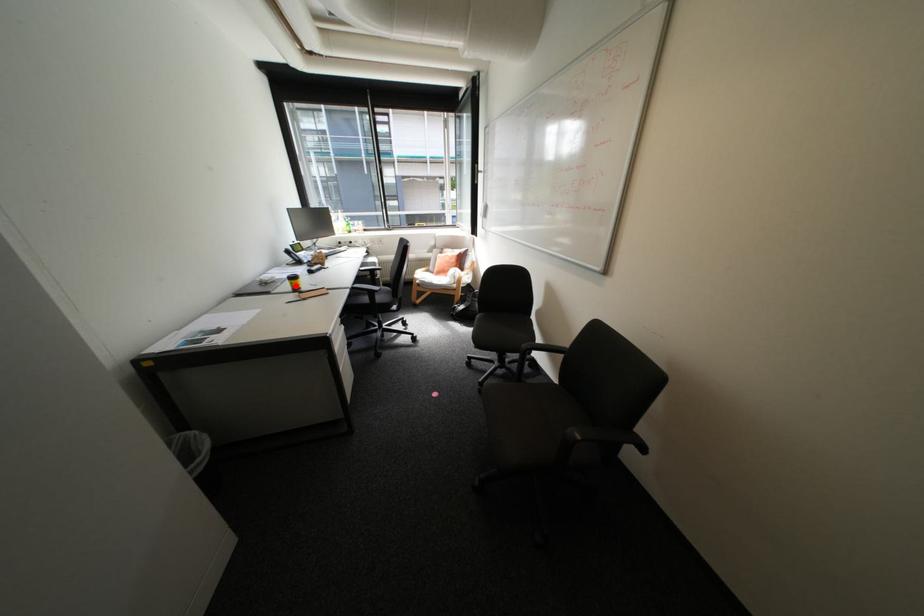
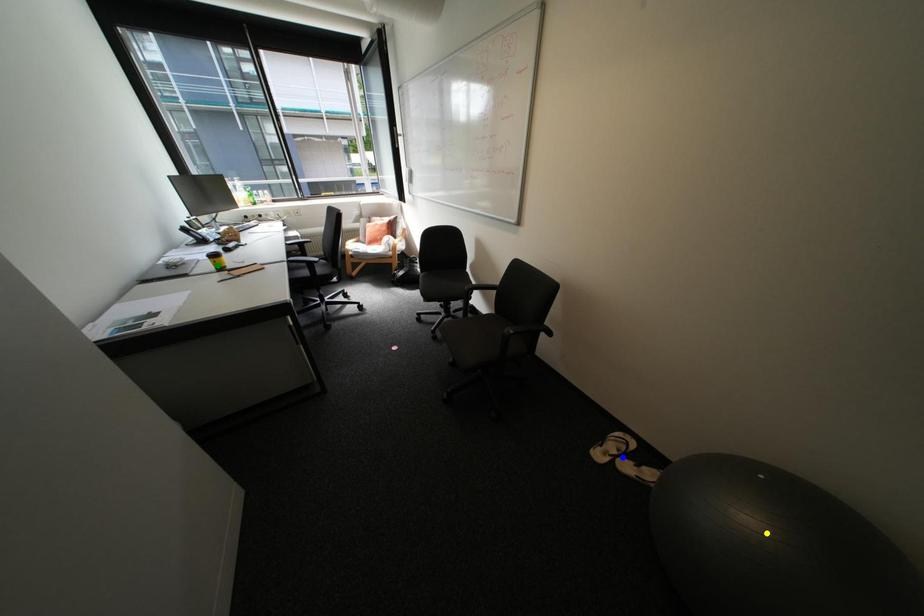
Question: I am providing you with two images of the same scene from different viewpoints. A red point is marked on the first image. You are given multiple points on the second image. Which point in image 2 represents the same 3d spot as the red point in image 1?

Choices:
 (A) blue point
 (B) green point
 (C) yellow point

Answer: (B)